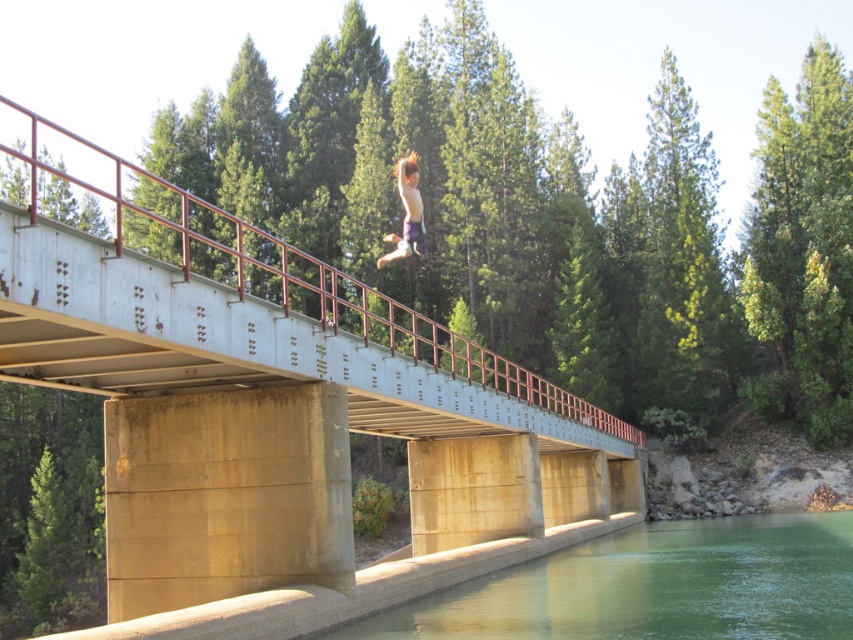
Question: Is green smooth water at lower center wider than shiny brown hair at center?

Choices:
 (A) no
 (B) yes

Answer: (B)

Question: Which point appears farthest from the camera in this image?

Choices:
 (A) (729, 620)
 (B) (107, 387)
 (C) (403, 180)

Answer: (C)

Question: Is concrete bridge at center below shiny brown hair at center?

Choices:
 (A) yes
 (B) no

Answer: (B)

Question: Among these points, which one is nearest to the camera?

Choices:
 (A) (401, 170)
 (B) (172, 506)
 (C) (782, 531)

Answer: (B)

Question: Which is farther from the green smooth water at lower center?

Choices:
 (A) concrete bridge at center
 (B) shiny brown hair at center

Answer: (B)

Question: Can you confirm if green smooth water at lower center is positioned to the left of shiny brown hair at center?

Choices:
 (A) no
 (B) yes

Answer: (A)